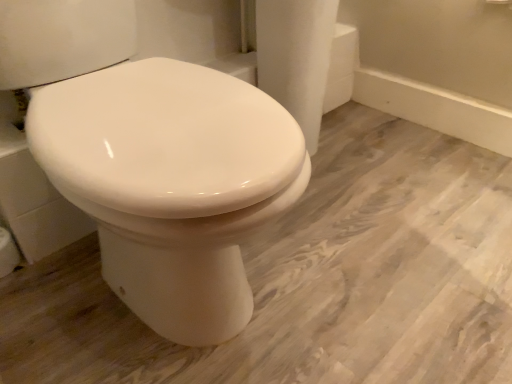
Where is `white glossy toilet at center`? white glossy toilet at center is located at coordinates (170, 183).

What do you see at coordinates (170, 183) in the screenshot? The height and width of the screenshot is (384, 512). I see `white glossy toilet at center` at bounding box center [170, 183].

Where is `white glossy toilet at center`? Image resolution: width=512 pixels, height=384 pixels. white glossy toilet at center is located at coordinates (170, 183).